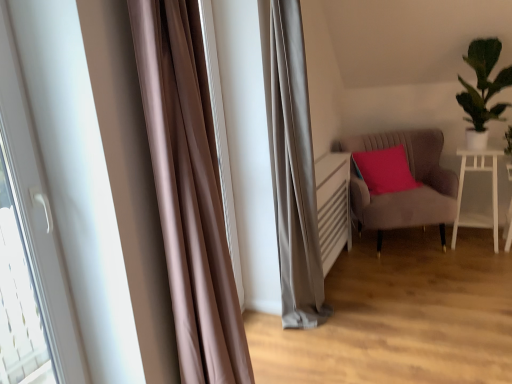
Question: Considering the relative sizes of satin brown curtain at left and green leafy plant at upper right in the image provided, is satin brown curtain at left smaller than green leafy plant at upper right?

Choices:
 (A) no
 (B) yes

Answer: (B)

Question: From the image's perspective, is satin brown curtain at left beneath green leafy plant at upper right?

Choices:
 (A) yes
 (B) no

Answer: (A)

Question: From a real-world perspective, does satin brown curtain at left stand above green leafy plant at upper right?

Choices:
 (A) yes
 (B) no

Answer: (B)

Question: Considering the relative sizes of satin brown curtain at left and green leafy plant at upper right in the image provided, is satin brown curtain at left thinner than green leafy plant at upper right?

Choices:
 (A) yes
 (B) no

Answer: (A)

Question: Can you confirm if satin brown curtain at left is wider than green leafy plant at upper right?

Choices:
 (A) yes
 (B) no

Answer: (B)

Question: Is green leafy plant at upper right inside satin brown curtain at left?

Choices:
 (A) no
 (B) yes

Answer: (A)

Question: From a real-world perspective, is suede-like beige armchair at right located beneath satin brown curtain at left?

Choices:
 (A) no
 (B) yes

Answer: (B)

Question: Is suede-like beige armchair at right thinner than satin brown curtain at left?

Choices:
 (A) no
 (B) yes

Answer: (A)

Question: Does suede-like beige armchair at right have a smaller size compared to satin brown curtain at left?

Choices:
 (A) no
 (B) yes

Answer: (A)

Question: From the image's perspective, would you say suede-like beige armchair at right is positioned over satin brown curtain at left?

Choices:
 (A) no
 (B) yes

Answer: (A)

Question: Does suede-like beige armchair at right have a lesser height compared to satin brown curtain at left?

Choices:
 (A) yes
 (B) no

Answer: (A)

Question: Does suede-like beige armchair at right have a larger size compared to satin brown curtain at left?

Choices:
 (A) no
 (B) yes

Answer: (B)

Question: Is suede-like beige armchair at right beside white glossy table at right?

Choices:
 (A) yes
 (B) no

Answer: (B)